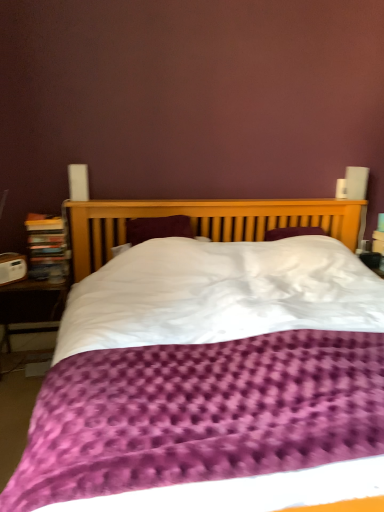
Question: Can you confirm if purple textured duvet at center is positioned to the left of wooden bookcase at left?

Choices:
 (A) yes
 (B) no

Answer: (B)

Question: Is purple textured duvet at center thinner than wooden bookcase at left?

Choices:
 (A) yes
 (B) no

Answer: (B)

Question: From a real-world perspective, is purple textured duvet at center located beneath wooden bookcase at left?

Choices:
 (A) no
 (B) yes

Answer: (B)

Question: Is purple textured duvet at center closer to the viewer compared to wooden bookcase at left?

Choices:
 (A) no
 (B) yes

Answer: (B)

Question: Is purple textured duvet at center located outside wooden bookcase at left?

Choices:
 (A) no
 (B) yes

Answer: (B)

Question: Is purple textured duvet at center oriented away from wooden bookcase at left?

Choices:
 (A) no
 (B) yes

Answer: (A)

Question: From a real-world perspective, is wooden table at lower left physically below purple textured duvet at center?

Choices:
 (A) no
 (B) yes

Answer: (B)

Question: From the image's perspective, is wooden table at lower left located beneath purple textured duvet at center?

Choices:
 (A) no
 (B) yes

Answer: (A)

Question: Is purple textured duvet at center inside wooden table at lower left?

Choices:
 (A) no
 (B) yes

Answer: (A)

Question: Is wooden table at lower left at the right side of purple textured duvet at center?

Choices:
 (A) yes
 (B) no

Answer: (B)

Question: Can you confirm if wooden table at lower left is taller than purple textured duvet at center?

Choices:
 (A) no
 (B) yes

Answer: (A)

Question: Is the position of wooden table at lower left more distant than that of purple textured duvet at center?

Choices:
 (A) yes
 (B) no

Answer: (A)

Question: Can wooden table at lower left be found inside purple textured duvet at center?

Choices:
 (A) yes
 (B) no

Answer: (B)